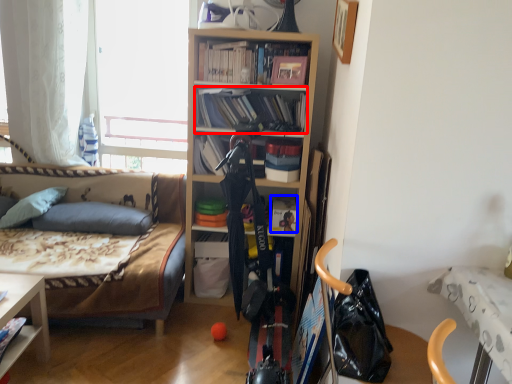
Question: Which of the following is the closest to the observer, book (highlighted by a red box) or book (highlighted by a blue box)?

Choices:
 (A) book
 (B) book

Answer: (A)